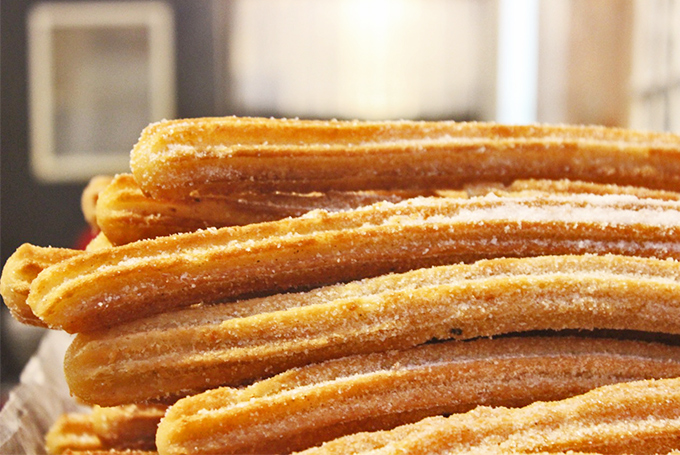
At what (x,y) coordinates should I click in order to perform the action: click on framed artwork. Please return your answer as a coordinate pair (x, y). Looking at the image, I should click on (101, 91).